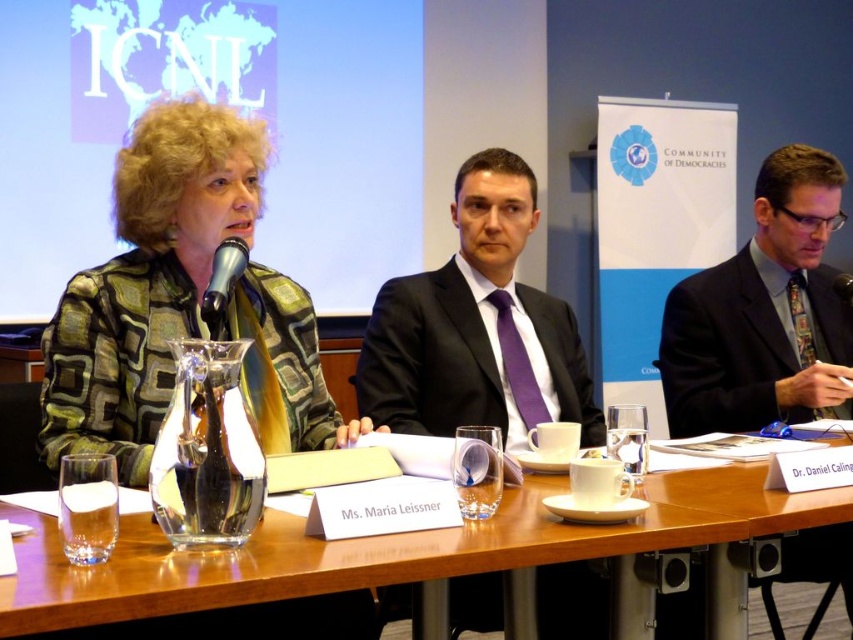
You are organizing a small workshop and need to place a 1.2 meter wide whiteboard between the green textured blazer at center and the wooden table at center. Can the whiteboard fit between them based on their widths?

The green textured blazer at center is narrower than the wooden table at center. However, the combined width of both objects is not provided. Without knowing the exact widths of each, it is impossible to determine if the 1.2 meter whiteboard can fit between them.

You are standing in the conference room and want to take a photo of the point at coordinates (135,257). The camera you are using has a minimum focus distance of 5 feet. Will the camera be able to focus on the point?

The point at coordinates (135,257) is 5.11 feet from the camera, which is slightly beyond the minimum focus distance of 5 feet. Therefore, the camera may struggle to focus on the point unless adjusted.

You are organizing a panel discussion and need to ensure that the green textured blazer at center and the shiny metallic microphone at center can fit side by side on a 1.2 meter wide table. Based on their sizes, will they both fit comfortably?

The green textured blazer at center is wider than the shiny metallic microphone at center. Since the table is 1.2 meters wide, and the combined width of both items is likely less than 1.2 meters, they should fit comfortably side by side.